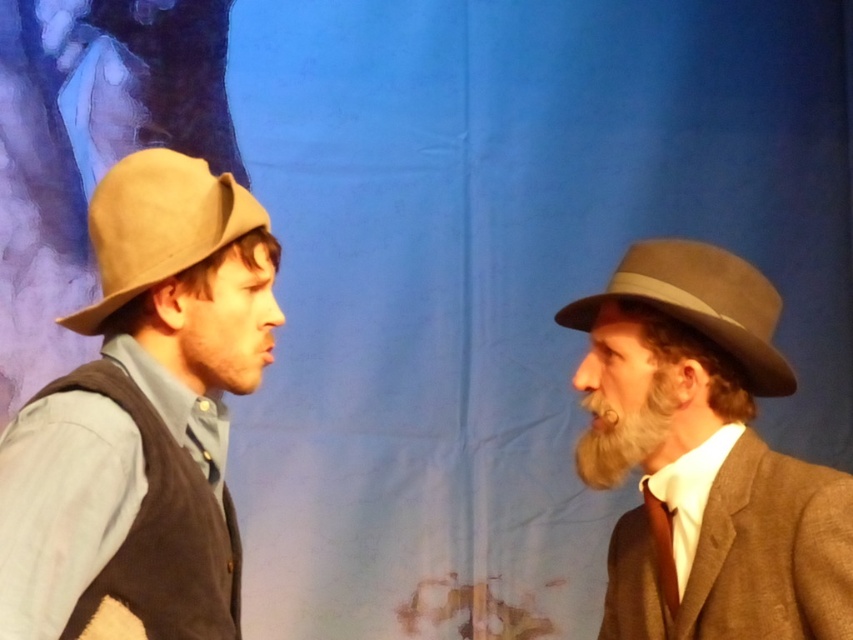
Question: Estimate the real-world distances between objects in this image. Which object is farther from the matte brown hat at left?

Choices:
 (A) brown felt hat at right
 (B) graywoollybeard at right
 (C) light brown felt fedora at left
 (D) brown silk tie at right

Answer: (D)

Question: Which object appears closest to the camera in this image?

Choices:
 (A) brown silk tie at right
 (B) matte brown hat at left

Answer: (B)

Question: Observing the image, what is the correct spatial positioning of brown felt fedora at right in reference to graywoollybeard at right?

Choices:
 (A) above
 (B) below

Answer: (A)

Question: Which is nearer to the light brown felt fedora at left?

Choices:
 (A) graywoollybeard at right
 (B) brown silk tie at right

Answer: (A)

Question: Can you confirm if brown felt hat at right is bigger than light brown felt fedora at left?

Choices:
 (A) yes
 (B) no

Answer: (A)

Question: Can you confirm if matte brown hat at left is positioned to the left of brown silk tie at right?

Choices:
 (A) yes
 (B) no

Answer: (A)